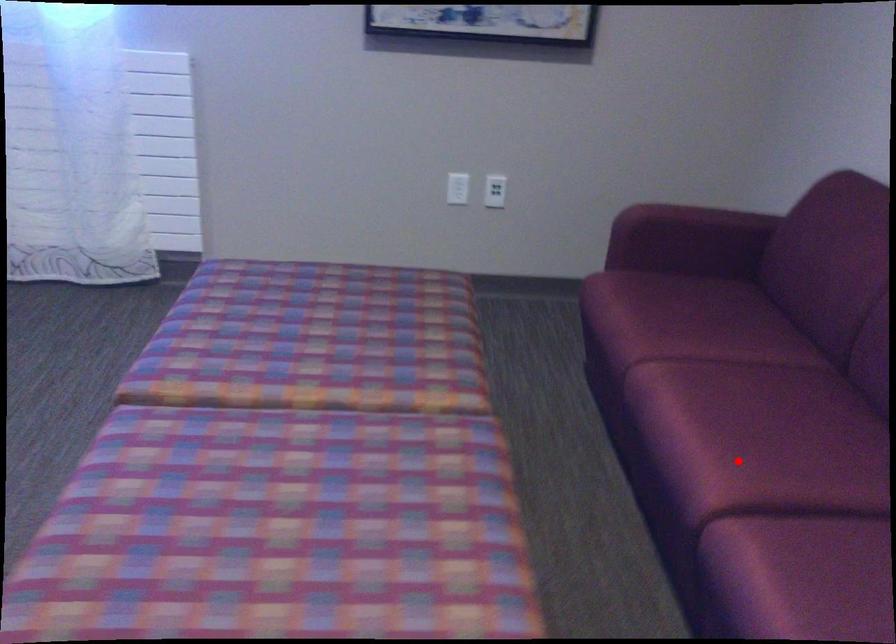
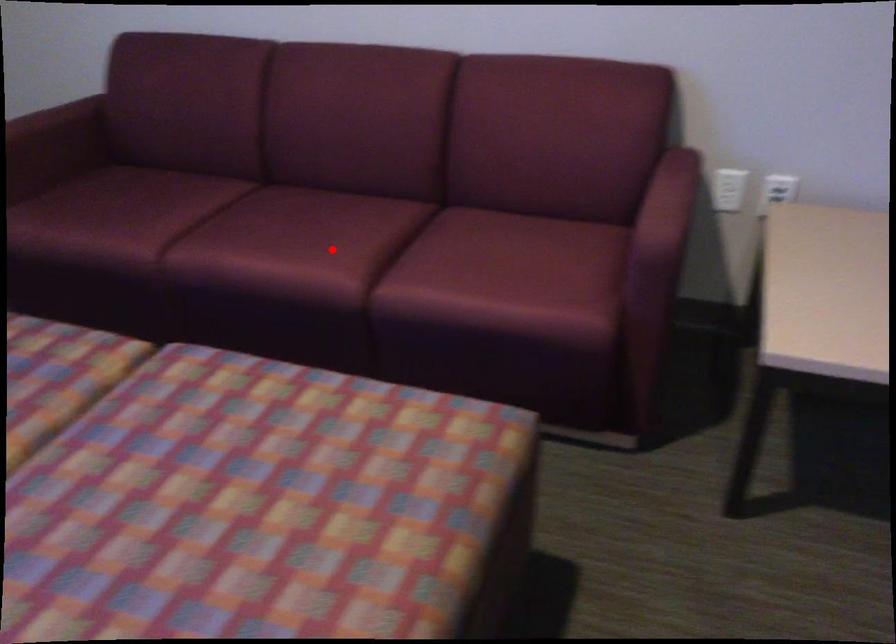
I am providing you with two images of the same scene from different viewpoints. A red point is marked on the first image and another point is marked on the second image. Is the marked point in image1 the same physical position as the marked point in image2?

Yes